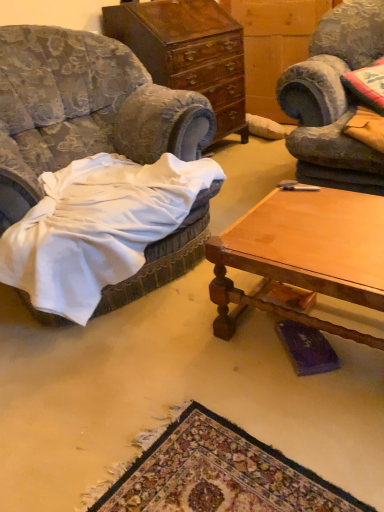
Question: From a real-world perspective, is wooden polished coffee table at center on top of polished wood cabinet at center?

Choices:
 (A) no
 (B) yes

Answer: (A)

Question: Considering the relative positions of wooden polished coffee table at center and polished wood cabinet at center in the image provided, is wooden polished coffee table at center to the right of polished wood cabinet at center from the viewer's perspective?

Choices:
 (A) no
 (B) yes

Answer: (B)

Question: Considering the relative sizes of wooden polished coffee table at center and polished wood cabinet at center in the image provided, is wooden polished coffee table at center wider than polished wood cabinet at center?

Choices:
 (A) no
 (B) yes

Answer: (B)

Question: Is wooden polished coffee table at center far from polished wood cabinet at center?

Choices:
 (A) no
 (B) yes

Answer: (B)

Question: Can you confirm if wooden polished coffee table at center is shorter than polished wood cabinet at center?

Choices:
 (A) yes
 (B) no

Answer: (A)

Question: Can you confirm if wooden polished coffee table at center is thinner than polished wood cabinet at center?

Choices:
 (A) no
 (B) yes

Answer: (A)

Question: Does polished wood cabinet at center have a greater width compared to wooden polished coffee table at center?

Choices:
 (A) no
 (B) yes

Answer: (A)

Question: Is polished wood cabinet at center facing away from wooden polished coffee table at center?

Choices:
 (A) no
 (B) yes

Answer: (A)

Question: Is polished wood cabinet at center oriented towards wooden polished coffee table at center?

Choices:
 (A) no
 (B) yes

Answer: (A)

Question: Does polished wood cabinet at center appear on the right side of wooden polished coffee table at center?

Choices:
 (A) no
 (B) yes

Answer: (A)

Question: Can you confirm if polished wood cabinet at center is bigger than wooden polished coffee table at center?

Choices:
 (A) no
 (B) yes

Answer: (B)

Question: Is polished wood cabinet at center thinner than wooden polished coffee table at center?

Choices:
 (A) yes
 (B) no

Answer: (A)

Question: From a real-world perspective, does polished wood cabinet at center stand above velvet blue armchair at left?

Choices:
 (A) yes
 (B) no

Answer: (B)